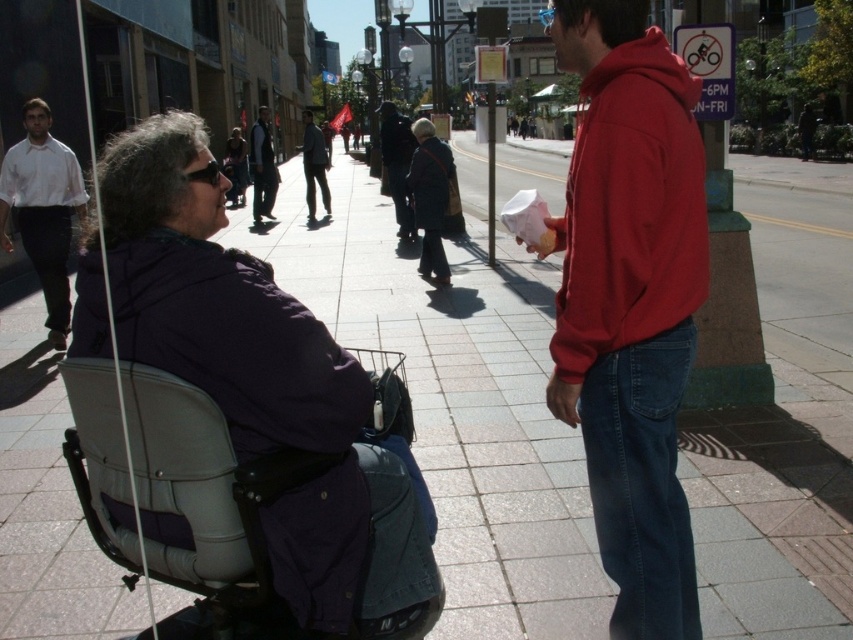
Does point (263, 138) come closer to viewer compared to point (318, 145)?

No, it is not.

Is point (248, 170) positioned after point (320, 177)?

Yes.

From the picture: Who is more distant from viewer, [253,129] or [310,140]?

Positioned behind is point [253,129].

At what (x,y) coordinates should I click in order to perform the action: click on dark gray suit at center. Please return your answer as a coordinate pair (x, y). Looking at the image, I should click on (262, 168).

Who is positioned more to the left, dark gray fabric handbag at center or dark blue jacket at center?

dark blue jacket at center

Find the location of a particular element. This screenshot has width=853, height=640. dark gray fabric handbag at center is located at coordinates (x=430, y=196).

Image resolution: width=853 pixels, height=640 pixels. I want to click on dark gray fabric handbag at center, so click(x=430, y=196).

The height and width of the screenshot is (640, 853). Find the location of `dark gray fabric handbag at center`. dark gray fabric handbag at center is located at coordinates (430, 196).

Who is taller, purple soft fabric wheelchair at left or dark gray fabric handbag at center?

purple soft fabric wheelchair at left

Can you confirm if purple soft fabric wheelchair at left is wider than dark gray fabric handbag at center?

Yes.

What do you see at coordinates (265, 387) in the screenshot?
I see `purple soft fabric wheelchair at left` at bounding box center [265, 387].

Where is `purple soft fabric wheelchair at left`? Image resolution: width=853 pixels, height=640 pixels. purple soft fabric wheelchair at left is located at coordinates (265, 387).